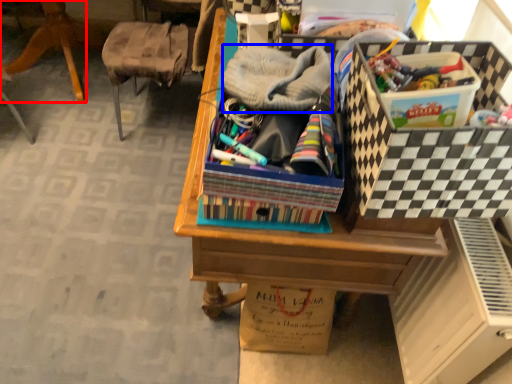
Question: Which object is further to the camera taking this photo, furniture (highlighted by a red box) or clothing (highlighted by a blue box)?

Choices:
 (A) furniture
 (B) clothing

Answer: (A)